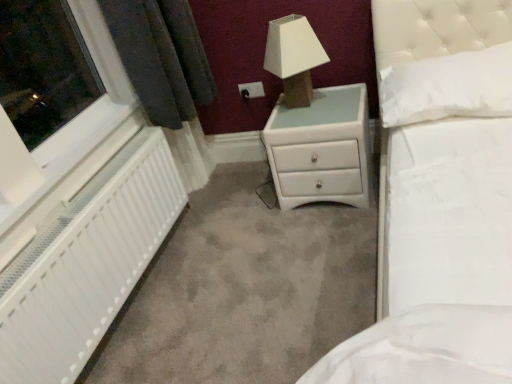
Question: Considering the relative sizes of white plastic electric outlet at upper center and white textured radiator at left in the image provided, is white plastic electric outlet at upper center wider than white textured radiator at left?

Choices:
 (A) no
 (B) yes

Answer: (A)

Question: Is white plastic electric outlet at upper center touching white textured radiator at left?

Choices:
 (A) yes
 (B) no

Answer: (B)

Question: Considering the relative sizes of white plastic electric outlet at upper center and white textured radiator at left in the image provided, is white plastic electric outlet at upper center taller than white textured radiator at left?

Choices:
 (A) no
 (B) yes

Answer: (A)

Question: Is white plastic electric outlet at upper center located outside white textured radiator at left?

Choices:
 (A) no
 (B) yes

Answer: (B)

Question: Is white plastic electric outlet at upper center at the left side of white textured radiator at left?

Choices:
 (A) yes
 (B) no

Answer: (B)

Question: Is white soft pillow at upper right spatially inside white glossy chest of drawers at center, or outside of it?

Choices:
 (A) inside
 (B) outside

Answer: (B)

Question: Considering the positions of white soft pillow at upper right and white glossy chest of drawers at center in the image, is white soft pillow at upper right taller or shorter than white glossy chest of drawers at center?

Choices:
 (A) tall
 (B) short

Answer: (B)

Question: From a real-world perspective, relative to white glossy chest of drawers at center, is white soft pillow at upper right vertically above or below?

Choices:
 (A) above
 (B) below

Answer: (A)

Question: In terms of width, does white soft pillow at upper right look wider or thinner when compared to white glossy chest of drawers at center?

Choices:
 (A) wide
 (B) thin

Answer: (B)

Question: In terms of height, does white fabric lampshade at upper center look taller or shorter compared to white glossy chest of drawers at center?

Choices:
 (A) short
 (B) tall

Answer: (A)

Question: From the image's perspective, is white fabric lampshade at upper center positioned above or below white glossy chest of drawers at center?

Choices:
 (A) above
 (B) below

Answer: (A)

Question: Considering the relative positions of white fabric lampshade at upper center and white glossy chest of drawers at center in the image provided, is white fabric lampshade at upper center to the left or to the right of white glossy chest of drawers at center?

Choices:
 (A) right
 (B) left

Answer: (B)

Question: Is point (286, 39) positioned closer to the camera than point (336, 173)?

Choices:
 (A) closer
 (B) farther

Answer: (A)

Question: Visually, is white fabric lampshade at upper center positioned to the left or to the right of white textured radiator at left?

Choices:
 (A) right
 (B) left

Answer: (A)

Question: Is white fabric lampshade at upper center taller or shorter than white textured radiator at left?

Choices:
 (A) tall
 (B) short

Answer: (B)